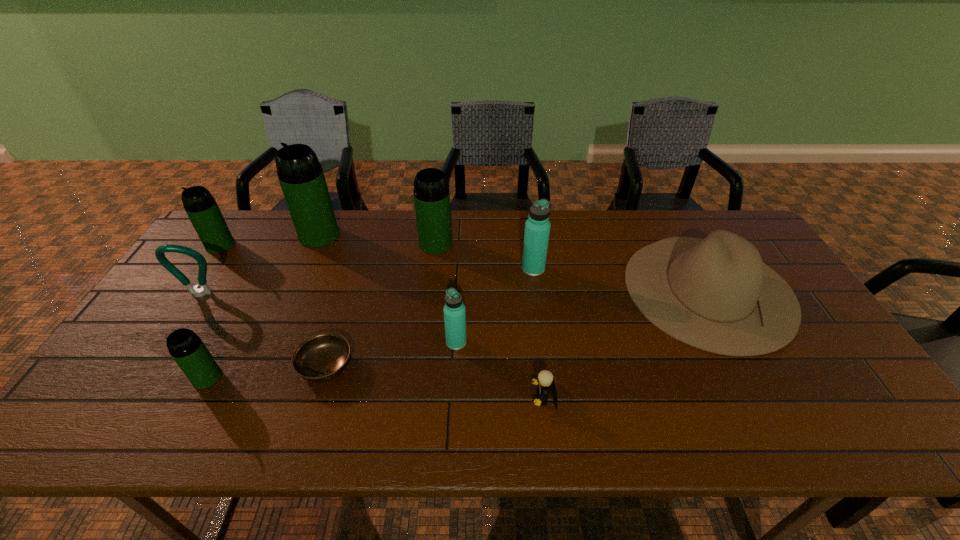
Image resolution: width=960 pixels, height=540 pixels. In order to click on the second green thermos bottle from right to left in this screenshot , I will do `click(300, 174)`.

At what (x,y) coordinates should I click in order to perform the action: click on the seventh object from right to left. Please return your answer as a coordinate pair (x, y). The image size is (960, 540). Looking at the image, I should click on 300,174.

The image size is (960, 540). Identify the location of the third thermos bottle from right to left. [x=431, y=191].

Locate an element on the screen. the rightmost green thermos bottle is located at coordinates (431, 191).

I want to click on the third biggest green thermos bottle, so click(200, 206).

This screenshot has width=960, height=540. I want to click on the leftmost green thermos bottle, so click(200, 206).

You are a GUI agent. You are given a task and a screenshot of the screen. Output one action in this format:
    pyautogui.click(x=<x>, y=<y>)
    Task: Click on the rightmost thermos bottle
    Image resolution: width=960 pixels, height=540 pixels.
    Given the screenshot: What is the action you would take?
    pyautogui.click(x=537, y=228)

Locate an element on the screen. The height and width of the screenshot is (540, 960). the bigger aqua thermos bottle is located at coordinates (537, 228).

Locate an element on the screen. Image resolution: width=960 pixels, height=540 pixels. bottle opener is located at coordinates (x=160, y=250).

Where is `the rightmost object`? Image resolution: width=960 pixels, height=540 pixels. the rightmost object is located at coordinates (716, 294).